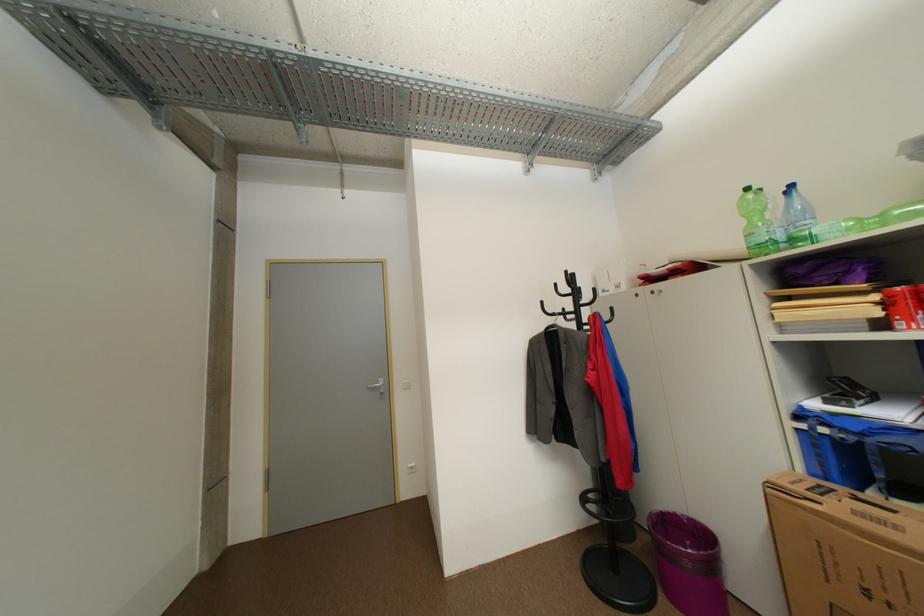
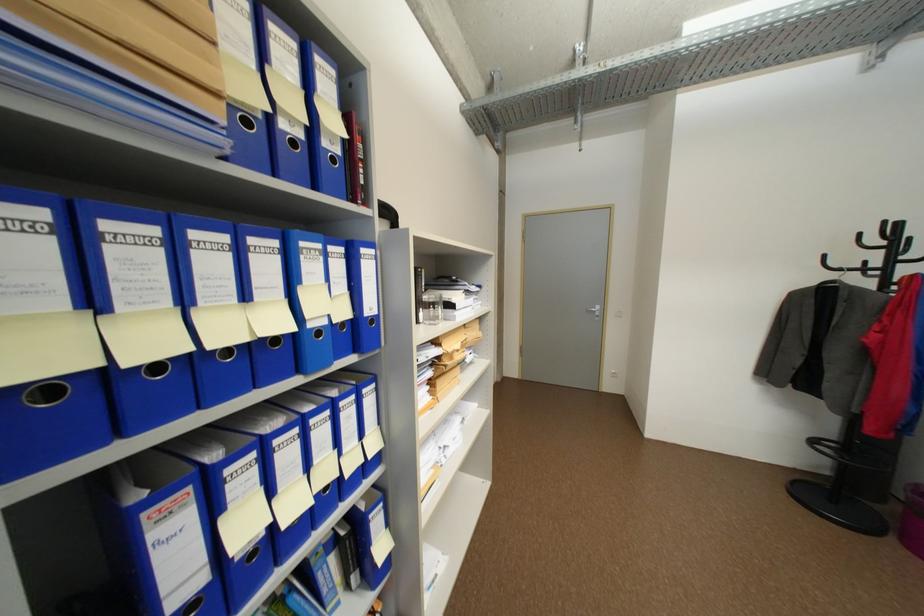
Where in the second image is the point corresponding to the point at 385,389 from the first image?

(602, 313)